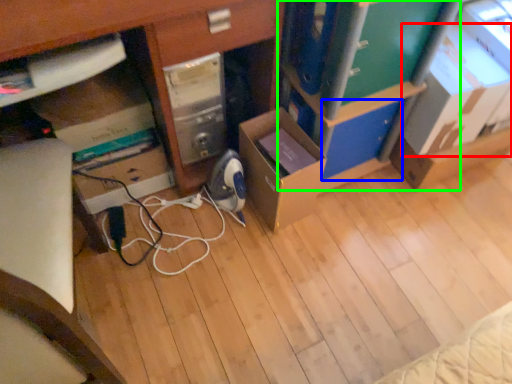
Question: Which is farther away from cardboard box (highlighted by a red box)? drawer (highlighted by a blue box) or bookshelf (highlighted by a green box)?

Choices:
 (A) drawer
 (B) bookshelf

Answer: (B)